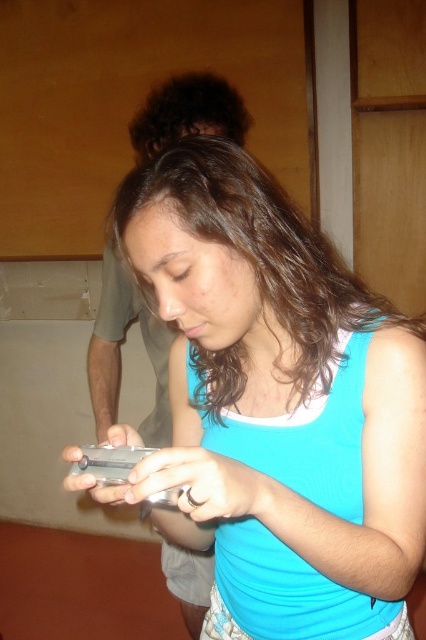
Does matte silver phone at center have a larger size compared to gray matte shirt at upper left?

Actually, matte silver phone at center might be smaller than gray matte shirt at upper left.

Is matte silver phone at center below gray matte shirt at upper left?

Yes.

Who is more distant from viewer, (305,611) or (103,416)?

Point (103,416)

This screenshot has height=640, width=426. I want to click on matte silver phone at center, so click(x=276, y=404).